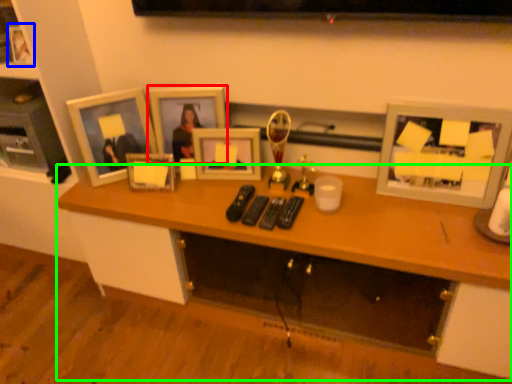
Question: Which object is the farthest from picture frame (highlighted by a red box)? Choose among these: picture frame (highlighted by a blue box) or desk (highlighted by a green box).

Choices:
 (A) picture frame
 (B) desk

Answer: (A)